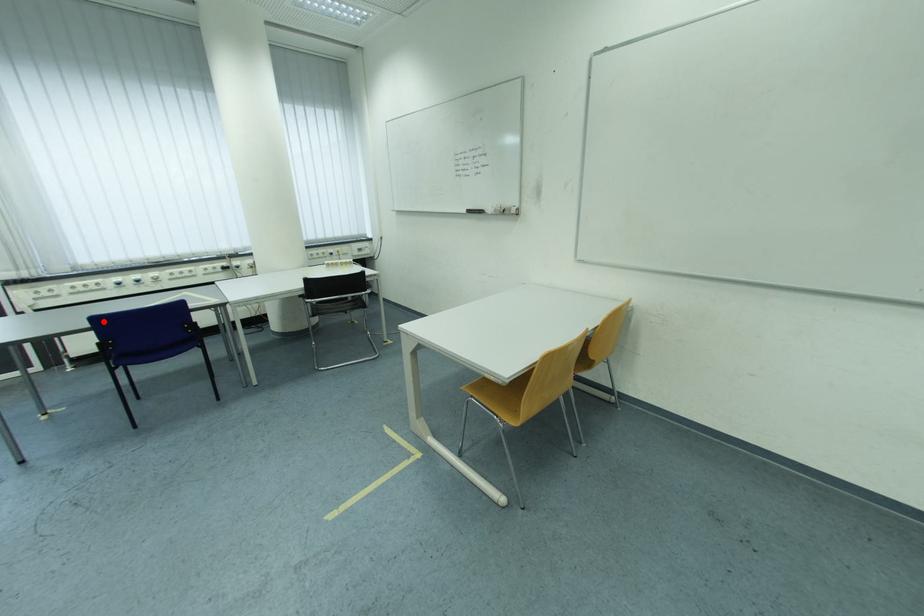
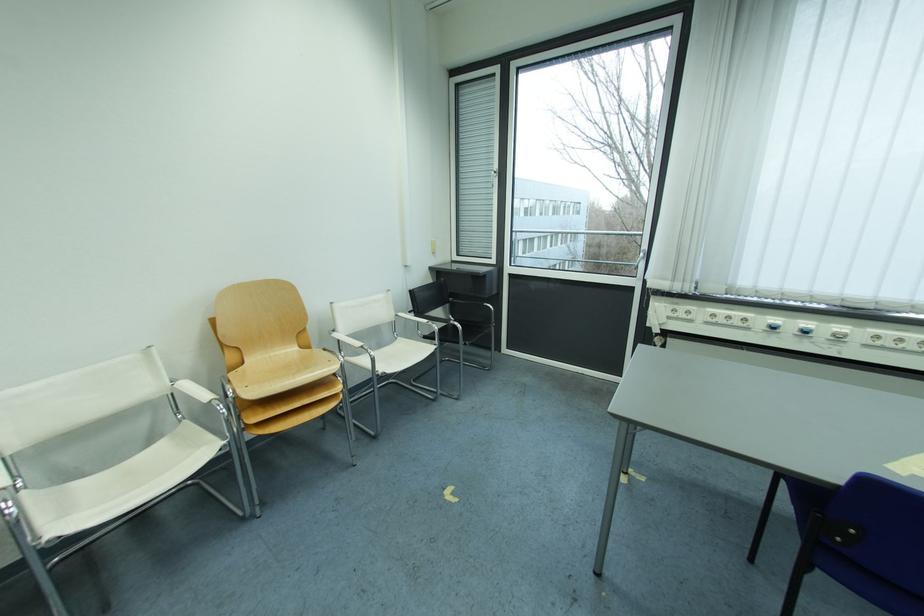
Question: A red point is marked in image1. In image2, is the corresponding 3D point closer to the camera or farther? Reply with the corresponding letter.

Choices:
 (A) The corresponding 3D point is closer.
 (B) The corresponding 3D point is farther.

Answer: (A)